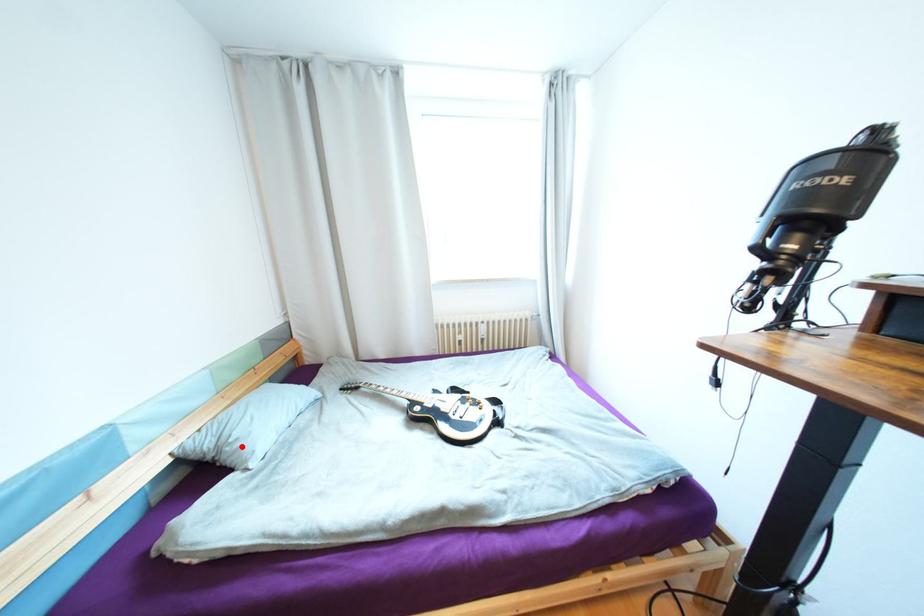
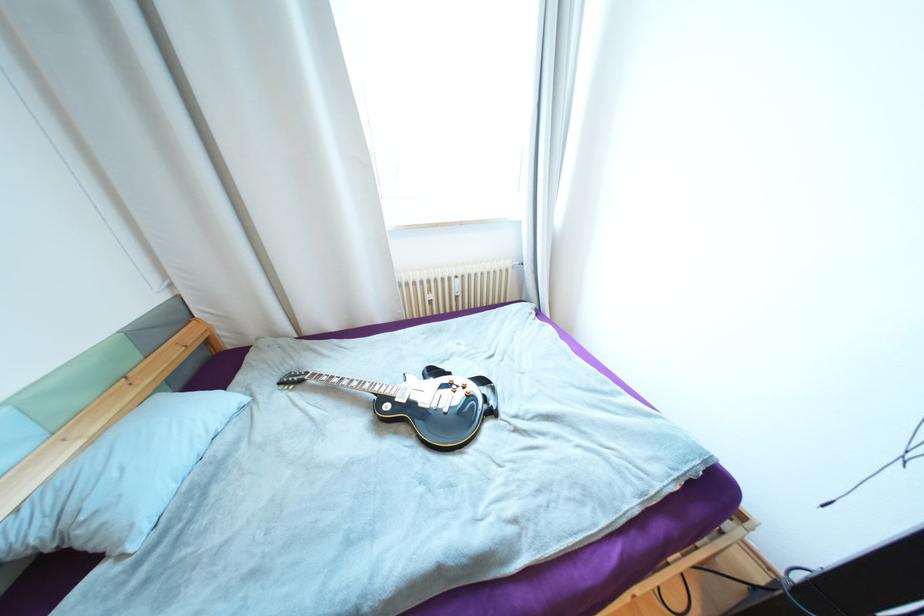
In the second image, find the point that corresponds to the highlighted location in the first image.

(101, 525)